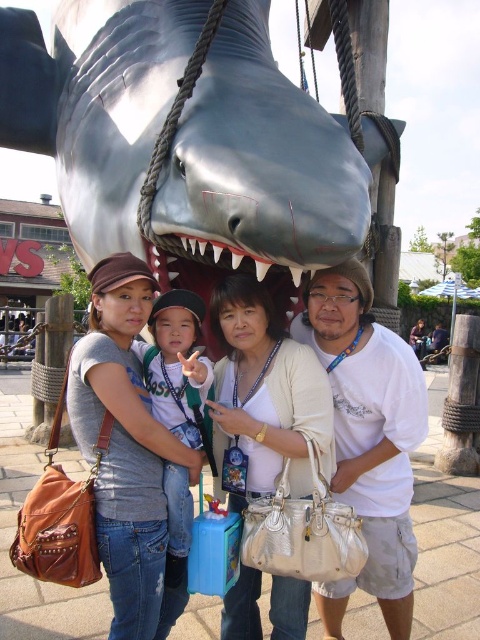
Question: Does shiny metallic shark at center come behind matte white purse at center?

Choices:
 (A) no
 (B) yes

Answer: (A)

Question: Does white matte jaw at center come behind green jersey at center?

Choices:
 (A) yes
 (B) no

Answer: (A)

Question: Which point is farther to the camera?

Choices:
 (A) (232, 417)
 (B) (12, 352)
 (C) (173, 488)
 (D) (210, 67)

Answer: (B)

Question: Which point is farther to the camera?

Choices:
 (A) matte gray shark at upper center
 (B) white matte jaw at center

Answer: (A)

Question: Considering the real-world distances, which object is farthest from the shiny metallic shark at center?

Choices:
 (A) green jersey at center
 (B) matte gray shark at upper center
 (C) white matte jaw at center
 (D) matte gray jaw at center

Answer: (B)

Question: Can you confirm if matte gray jaw at center is wider than matte gray shark at upper center?

Choices:
 (A) no
 (B) yes

Answer: (A)